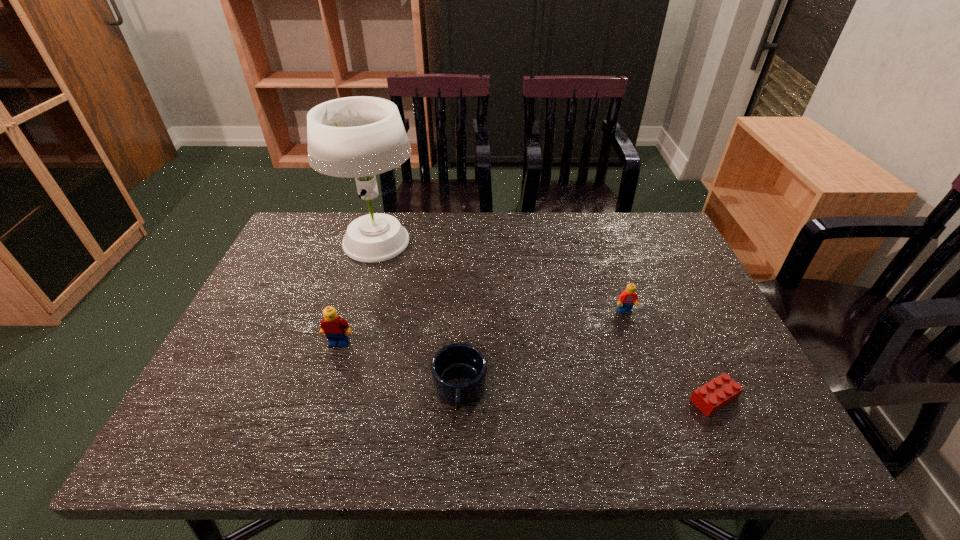
Find the location of a particular element. The image size is (960, 540). lamp is located at coordinates (361, 136).

This screenshot has width=960, height=540. Find the location of `the tallest object`. the tallest object is located at coordinates (361, 136).

The width and height of the screenshot is (960, 540). I want to click on the tallest Lego, so pos(335,328).

Where is `the leftmost Lego`? Image resolution: width=960 pixels, height=540 pixels. the leftmost Lego is located at coordinates (335, 328).

What are the coordinates of `the second shortest Lego` in the screenshot? It's located at (627, 298).

Where is `the third tallest object`? Image resolution: width=960 pixels, height=540 pixels. the third tallest object is located at coordinates (627, 298).

Identify the location of mug. The image size is (960, 540). (459, 372).

This screenshot has height=540, width=960. Identify the location of the fourth tallest object. (459, 372).

Locate an element on the screen. This screenshot has width=960, height=540. the shortest object is located at coordinates pyautogui.click(x=719, y=392).

You are a GUI agent. You are given a task and a screenshot of the screen. Output one action in this format:
    pyautogui.click(x=<x>, y=<y>)
    Task: Click on the rightmost object
    Image resolution: width=960 pixels, height=540 pixels.
    Given the screenshot: What is the action you would take?
    pyautogui.click(x=719, y=392)